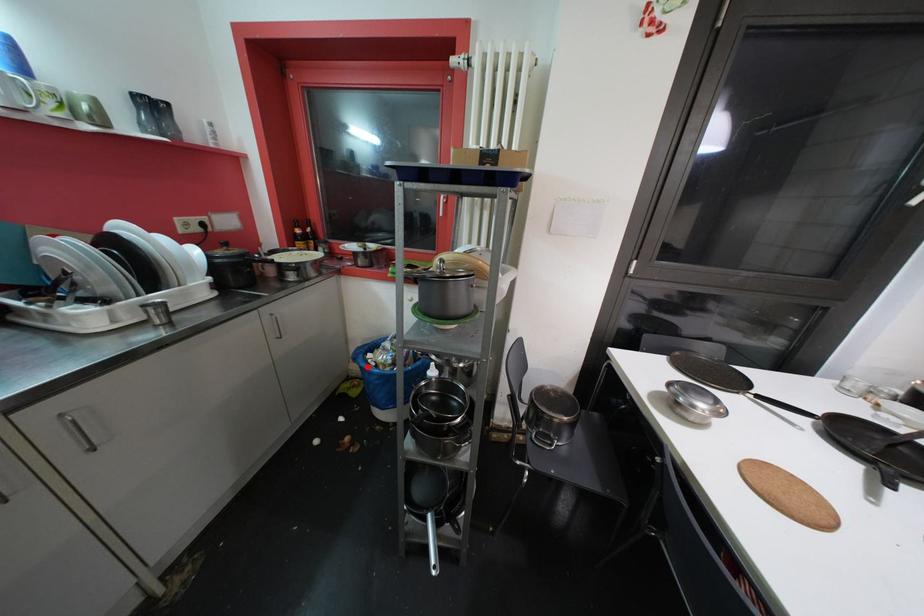
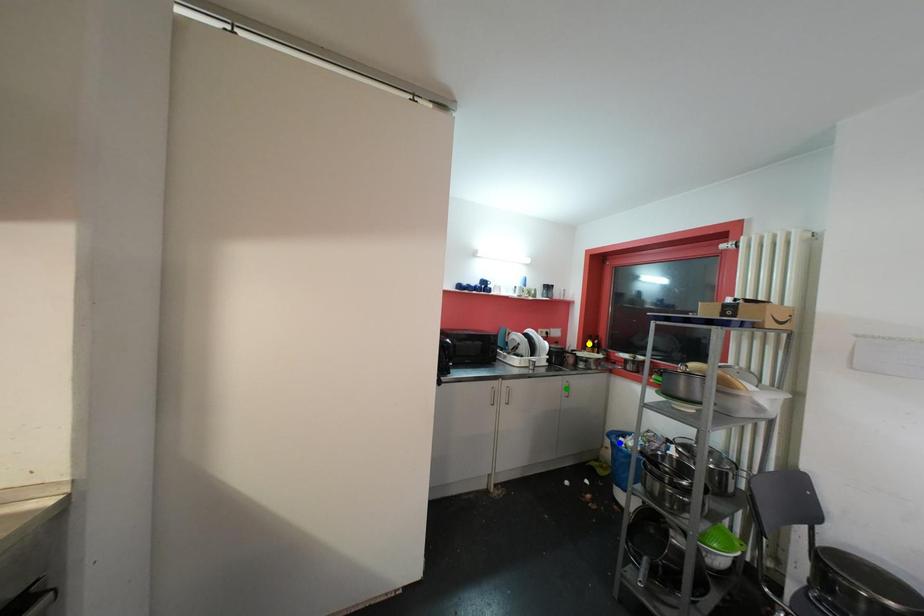
Question: I am providing you with two images of the same scene from different viewpoints. A red point is marked on the first image. You are given multiple points on the second image. Which point in image 2 represents the same 3d spot as the red point in image 1?

Choices:
 (A) yellow point
 (B) blue point
 (C) green point

Answer: (B)